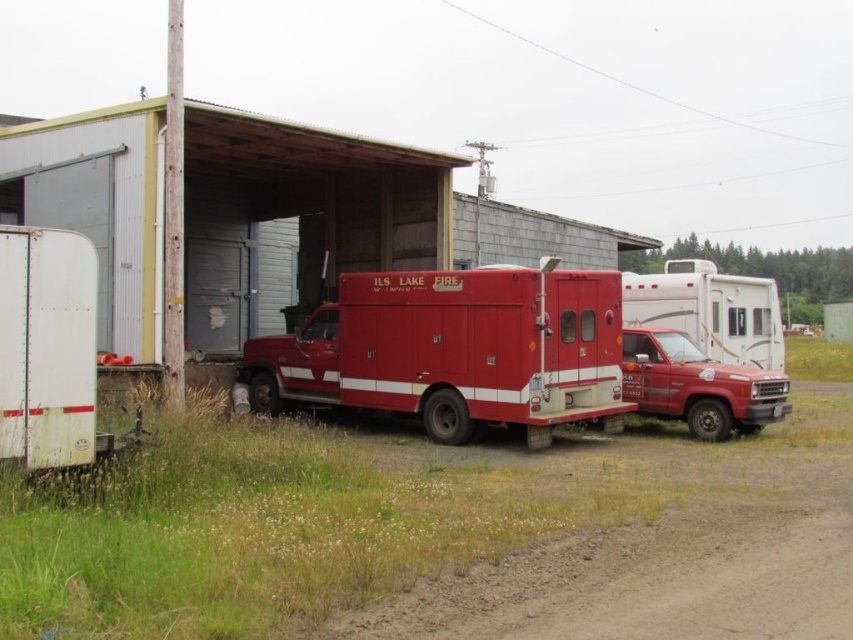
You are standing in front of the fire truck scene. There are two fire trucks labeled as metallic red fire truck at center and matte red fire truck at center. Which one is nearer to you?

The metallic red fire truck at center is closer to the viewer than the matte red fire truck at center.

You are standing in front of the fire truck and looking at the two points marked on the image. Which point, point [25,556] or point [721,387], is closer to your eyes?

Point [25,556] is closer to the camera than point [721,387], so the point closer to your eyes is point [25,556].